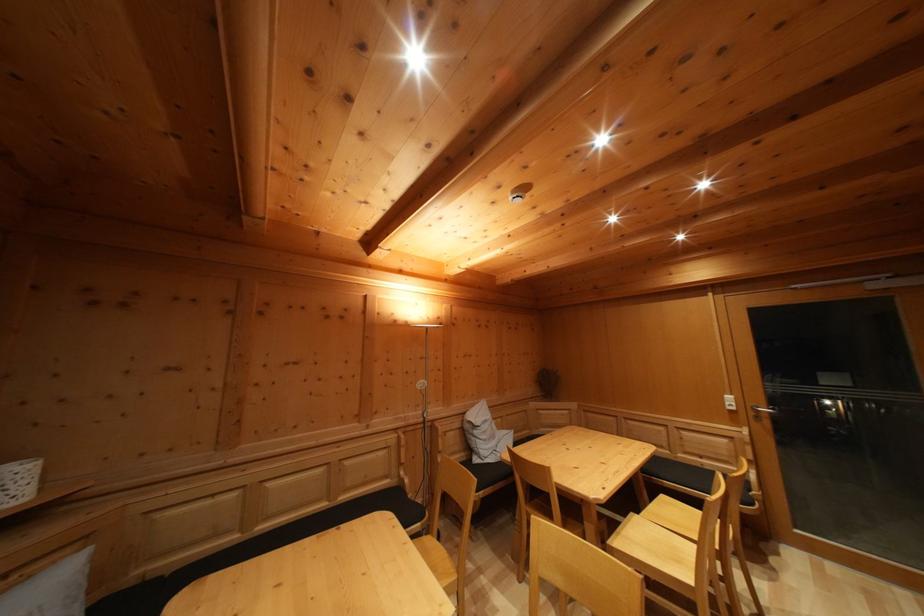
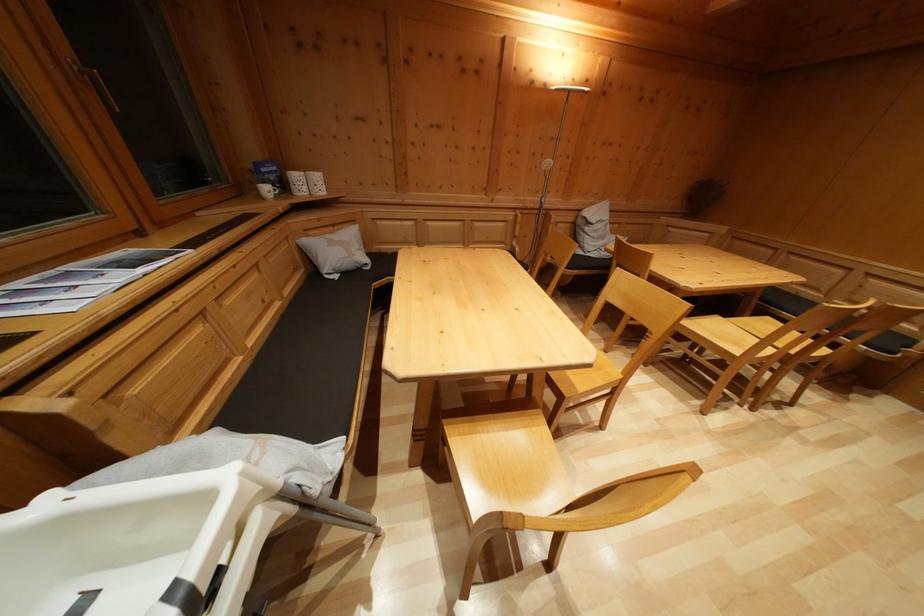
Locate, in the second image, the point that corresponds to (684,568) in the first image.

(743, 352)